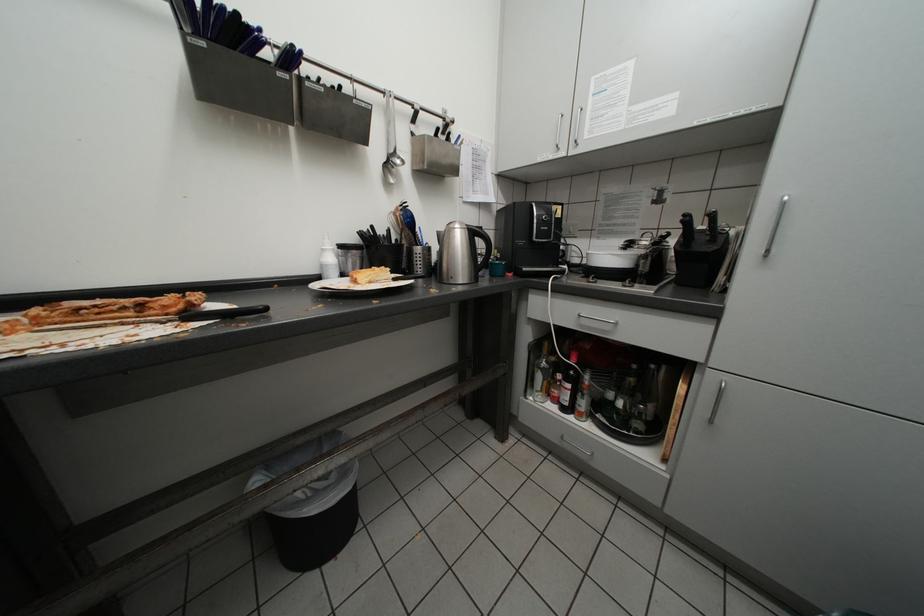
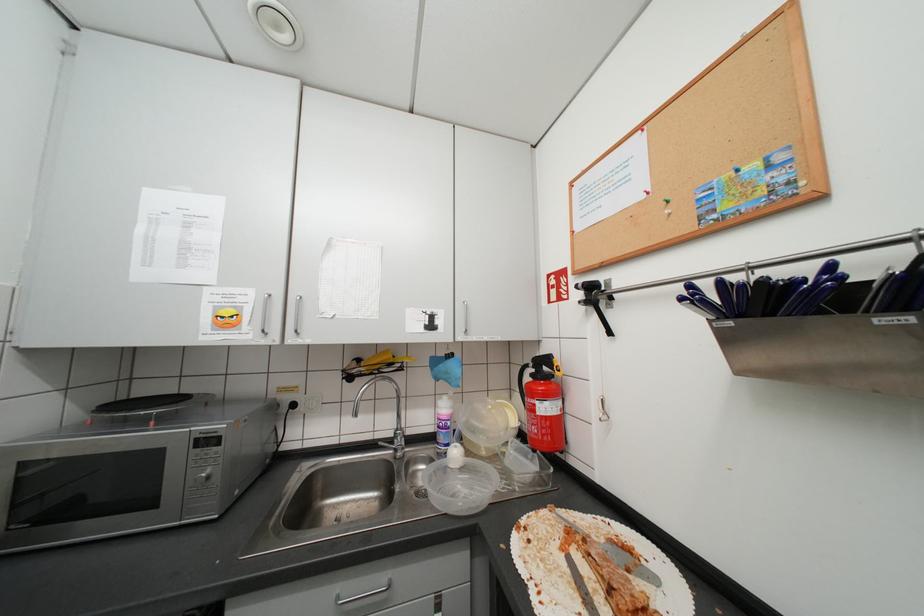
Question: How did the camera likely rotate?

Choices:
 (A) Left
 (B) Right
 (C) Up
 (D) Down

Answer: (A)